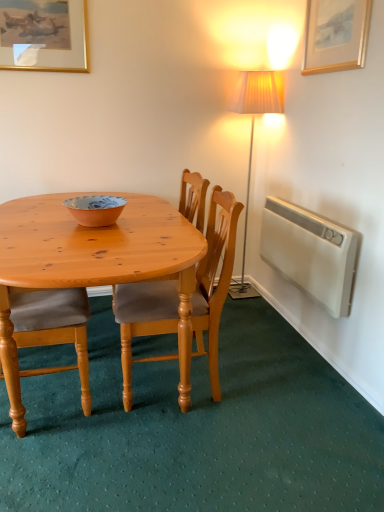
Where is `vacant region below white plastic radiator at right (from a real-world perspective)`? The height and width of the screenshot is (512, 384). vacant region below white plastic radiator at right (from a real-world perspective) is located at coordinates (300, 332).